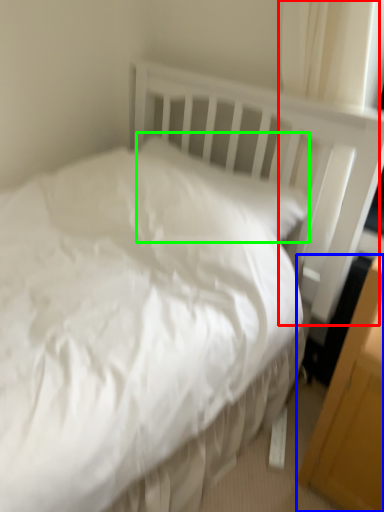
Question: Which is farther away from curtain (highlighted by a red box)? file cabinet (highlighted by a blue box) or pillow (highlighted by a green box)?

Choices:
 (A) file cabinet
 (B) pillow

Answer: (A)